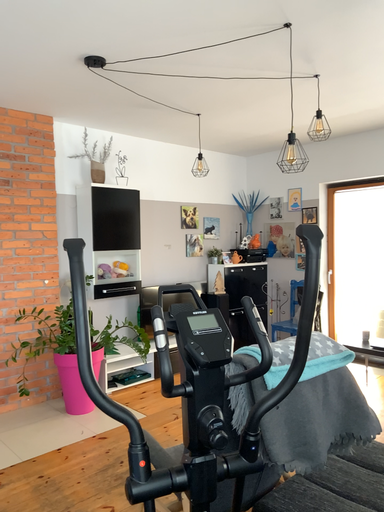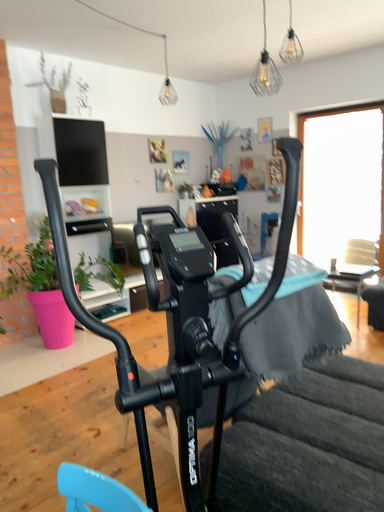
Question: How did the camera likely rotate when shooting the video?

Choices:
 (A) rotated downward
 (B) rotated upward

Answer: (A)